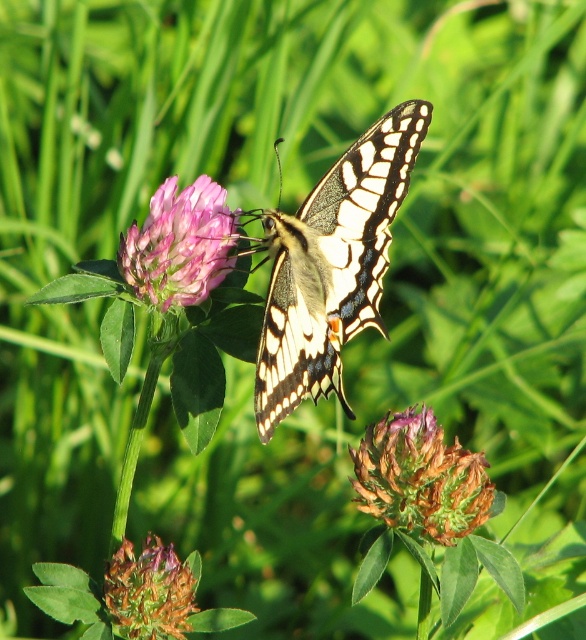
Question: Which of the following is the farthest from the observer?

Choices:
 (A) brown textured flower at lower left
 (B) pink velvet clover at center

Answer: (B)

Question: Which of the following is the closest to the observer?

Choices:
 (A) brown fuzzy flower at lower center
 (B) pink velvet clover at center

Answer: (A)

Question: Does translucent yellow butterfly at center have a larger size compared to brown textured flower at lower left?

Choices:
 (A) yes
 (B) no

Answer: (A)

Question: Estimate the real-world distances between objects in this image. Which object is farther from the pink velvet clover at center?

Choices:
 (A) brown fuzzy flower at lower center
 (B) translucent yellow butterfly at center

Answer: (A)

Question: Observing the image, what is the correct spatial positioning of brown fuzzy flower at lower center in reference to brown textured flower at lower left?

Choices:
 (A) right
 (B) left

Answer: (A)

Question: Can you confirm if translucent yellow butterfly at center is positioned below brown fuzzy flower at lower center?

Choices:
 (A) no
 (B) yes

Answer: (A)